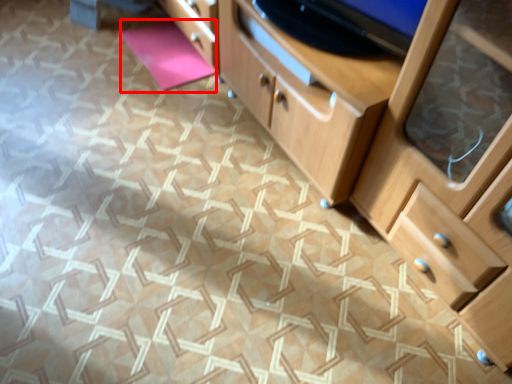
Question: From the image's perspective, considering the relative positions of yoga mat (annotated by the red box) and chest of drawers in the image provided, where is yoga mat (annotated by the red box) located with respect to the staircase?

Choices:
 (A) above
 (B) below

Answer: (A)